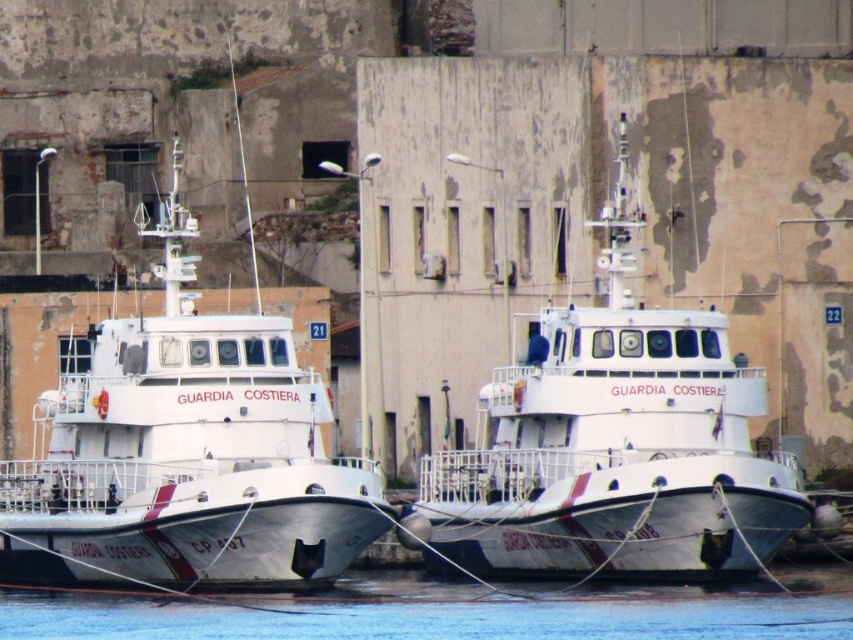
Is white glossy boat at left smaller than blue water at lower center?

No, white glossy boat at left is not smaller than blue water at lower center.

Is white glossy boat at left bigger than blue water at lower center?

Yes.

Who is more distant from viewer, (216, 547) or (808, 608)?

The point (216, 547) is more distant.

What are the coordinates of `white glossy boat at left` in the screenshot? It's located at (186, 456).

Is point (726, 432) farther from viewer compared to point (341, 625)?

Yes, it is behind point (341, 625).

Does white glossy boat at center appear under blue water at lower center?

Incorrect, white glossy boat at center is not positioned below blue water at lower center.

The width and height of the screenshot is (853, 640). What do you see at coordinates (612, 449) in the screenshot?
I see `white glossy boat at center` at bounding box center [612, 449].

Find the location of `white glossy boat at center`. white glossy boat at center is located at coordinates (612, 449).

Does white glossy boat at left have a smaller size compared to white glossy boat at center?

No, white glossy boat at left is not smaller than white glossy boat at center.

Is white glossy boat at left wider than white glossy boat at center?

Correct, the width of white glossy boat at left exceeds that of white glossy boat at center.

The width and height of the screenshot is (853, 640). What are the coordinates of `white glossy boat at left` in the screenshot? It's located at (186, 456).